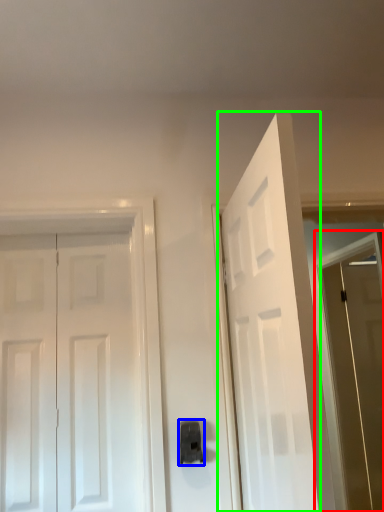
Question: Considering the real-world distances, which object is farthest from screen door (highlighted by a red box)? door handle (highlighted by a blue box) or door (highlighted by a green box)?

Choices:
 (A) door handle
 (B) door

Answer: (A)